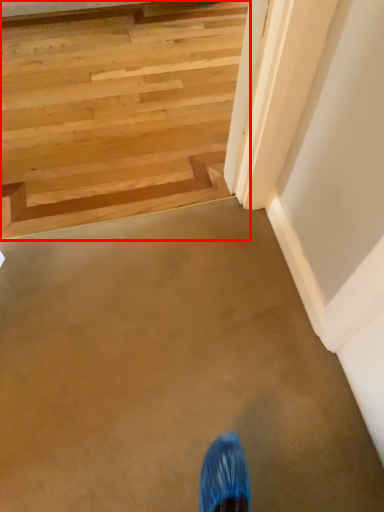
Question: From the image's perspective, where is stairs (annotated by the red box) located in relation to stairwell in the image?

Choices:
 (A) below
 (B) above

Answer: (B)